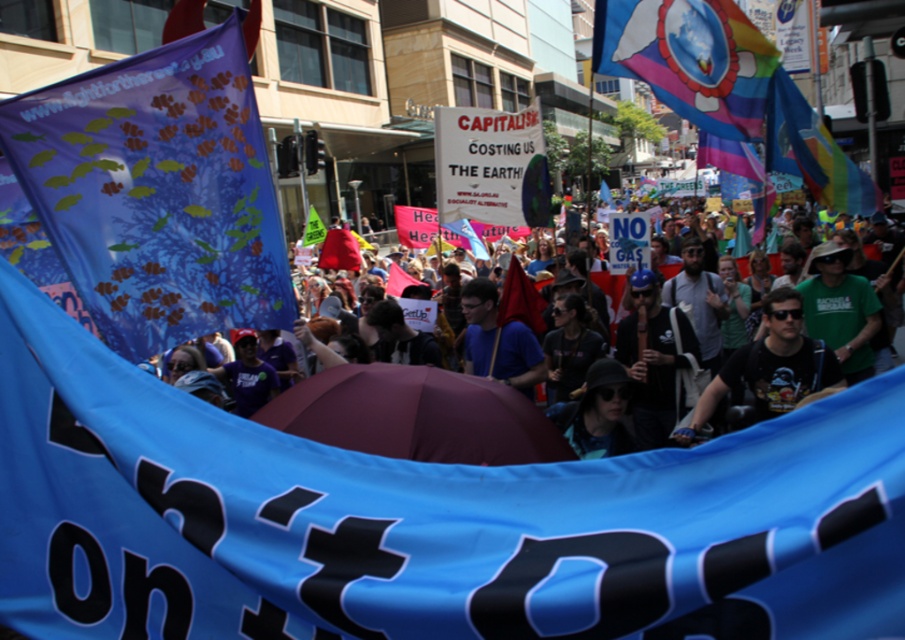
Does blue fabric banner with fish prints at left have a greater width compared to black matte t-shirt at center?

Yes.

Who is lower down, blue fabric banner with fish prints at left or black matte t-shirt at center?

black matte t-shirt at center is lower down.

Does point (124, 164) come closer to viewer compared to point (694, 426)?

Yes, point (124, 164) is closer to viewer.

The height and width of the screenshot is (640, 905). Find the location of `blue fabric banner with fish prints at left`. blue fabric banner with fish prints at left is located at coordinates (157, 192).

Looking at this image, between blue fabric crowd at center and maroon fabric umbrella at center, which one appears on the left side from the viewer's perspective?

From the viewer's perspective, blue fabric crowd at center appears more on the left side.

Does blue fabric crowd at center have a lesser width compared to maroon fabric umbrella at center?

Yes.

Between point (306, 332) and point (353, 394), which one is positioned in front?

Point (353, 394) is in front.

The height and width of the screenshot is (640, 905). What are the coordinates of `blue fabric crowd at center` in the screenshot? It's located at (378, 419).

Who is positioned more to the left, maroon fabric umbrella at center or blue t-shirt at center?

maroon fabric umbrella at center is more to the left.

Measure the distance between maroon fabric umbrella at center and blue t-shirt at center.

maroon fabric umbrella at center is 3.00 meters away from blue t-shirt at center.

Between point (383, 406) and point (506, 333), which one is positioned in front?

Point (383, 406) is more forward.

Image resolution: width=905 pixels, height=640 pixels. In order to click on maroon fabric umbrella at center in this screenshot , I will do `click(416, 416)`.